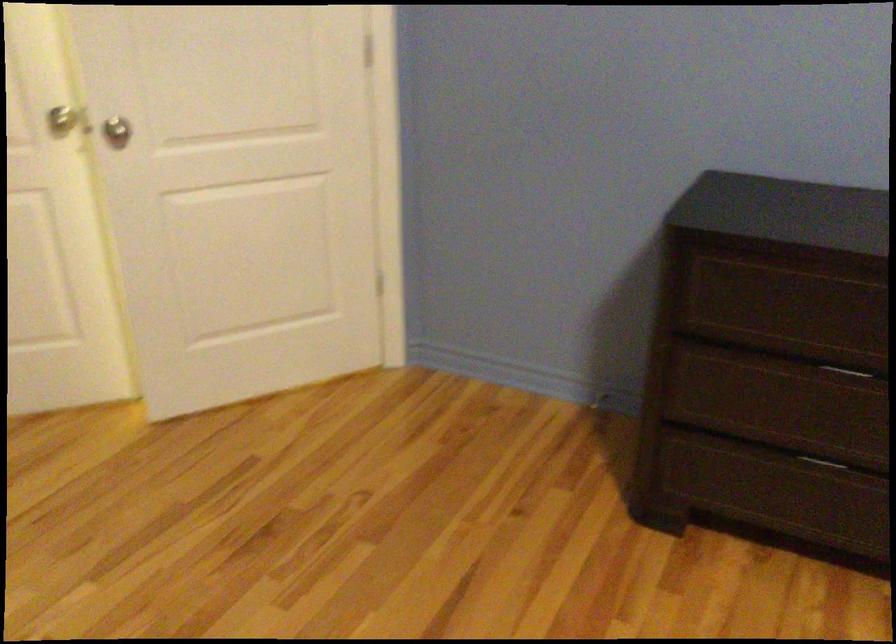
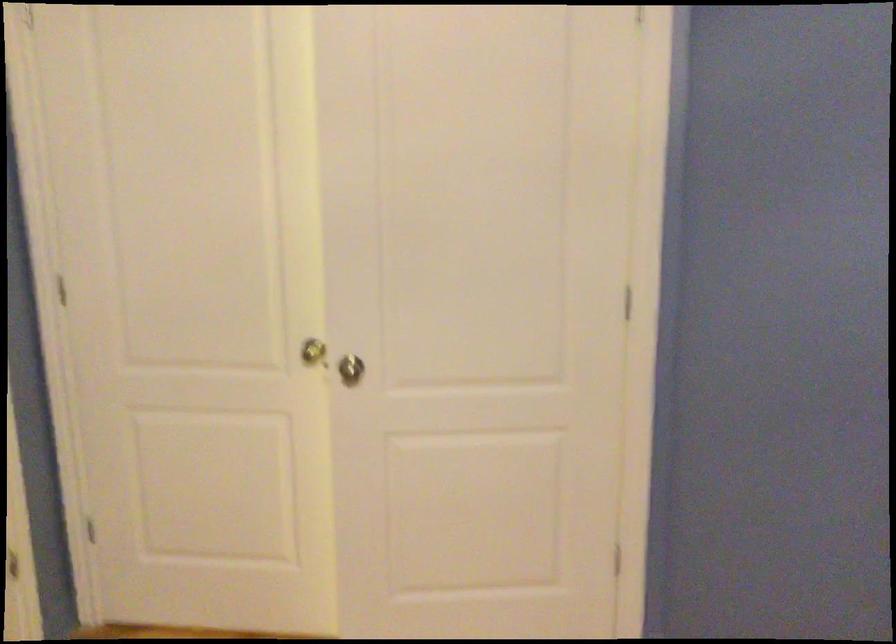
Question: The camera is either moving clockwise (left) or counter-clockwise (right) around the object. The first image is from the beginning of the video and the second image is from the end. Is the camera moving left or right when shooting the video?

Choices:
 (A) Left
 (B) Right

Answer: (B)